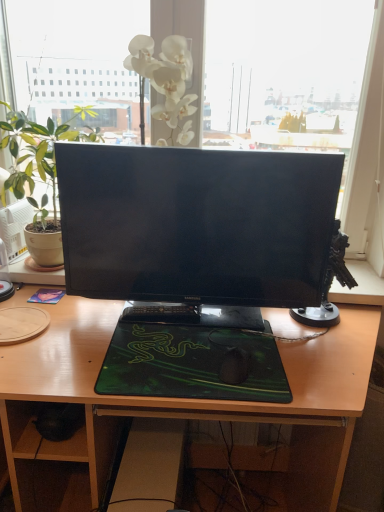
The width and height of the screenshot is (384, 512). What are the coordinates of `blank space above wooden desk at center (from a real-world perspective)` in the screenshot? It's located at (144, 330).